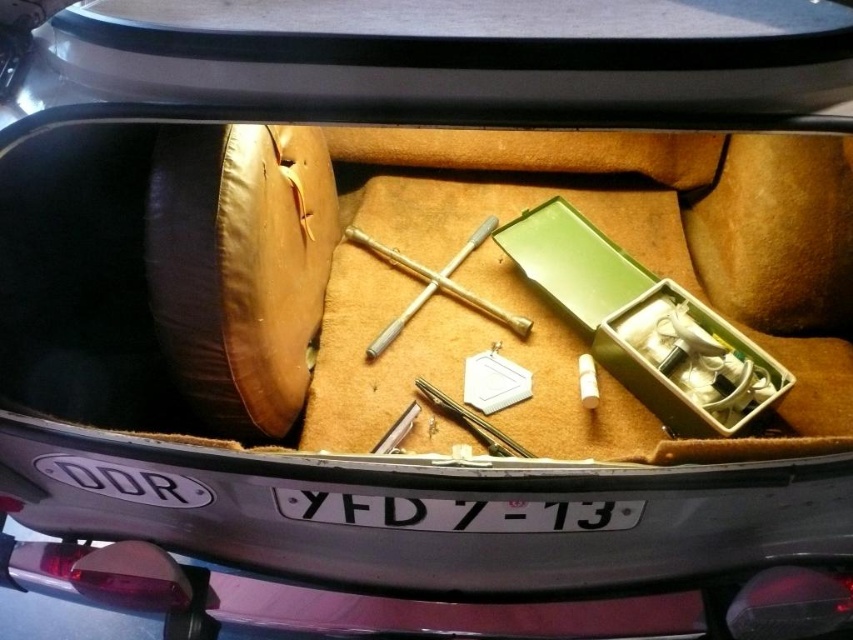
Which is more to the left, brass/bronze metal wrench at center or metallic silver tool at center?

From the viewer's perspective, brass/bronze metal wrench at center appears more on the left side.

Does brass/bronze metal wrench at center appear under metallic silver tool at center?

No, brass/bronze metal wrench at center is not below metallic silver tool at center.

Which is behind, point (405, 268) or point (445, 408)?

Point (405, 268)

Where is `brass/bronze metal wrench at center`? brass/bronze metal wrench at center is located at coordinates click(434, 285).